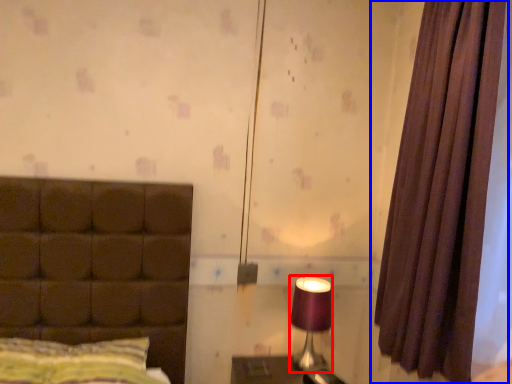
Question: Which object appears closest to the camera in this image, table lamp (highlighted by a red box) or curtain (highlighted by a blue box)?

Choices:
 (A) table lamp
 (B) curtain

Answer: (B)